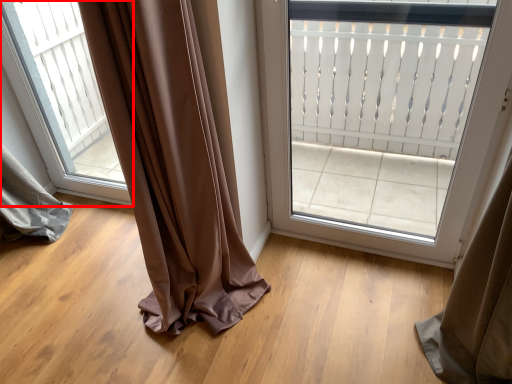
Question: Observing the image, what is the correct spatial positioning of window (annotated by the red box) in reference to door?

Choices:
 (A) right
 (B) left

Answer: (B)